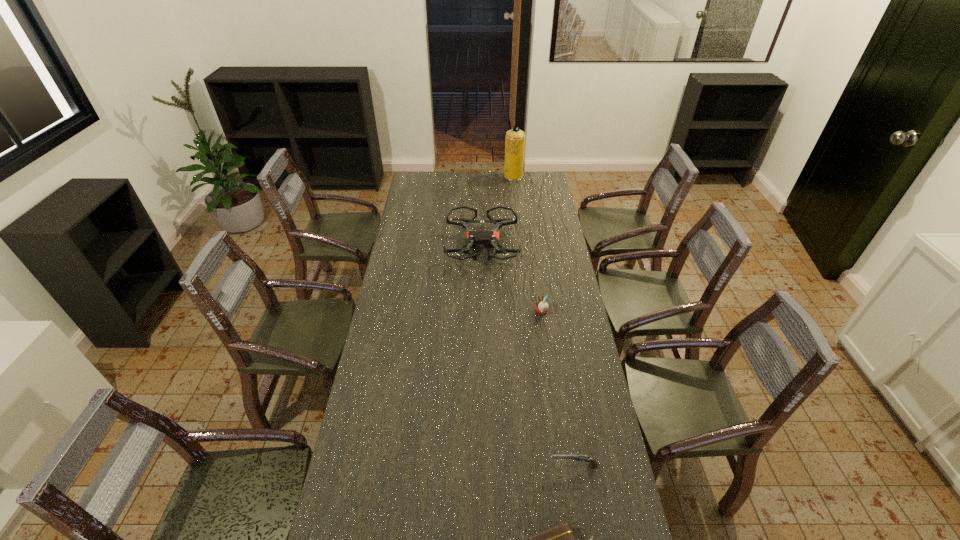
Locate an element on the screen. the farthest object is located at coordinates (515, 138).

I want to click on aerosol can, so click(x=515, y=138).

This screenshot has height=540, width=960. Identify the location of drone. (488, 239).

The height and width of the screenshot is (540, 960). I want to click on muffin, so click(542, 306).

Locate an element on the screen. The height and width of the screenshot is (540, 960). gun is located at coordinates (593, 463).

You are a GUI agent. You are given a task and a screenshot of the screen. Output one action in this format:
    pyautogui.click(x=<x>, y=<y>)
    Task: Click on the free spot located on the front of the farthest object
    This screenshot has width=960, height=540.
    Given the screenshot: What is the action you would take?
    pyautogui.click(x=517, y=213)

This screenshot has height=540, width=960. What are the coordinates of `vacant position located with the camera facing forward on the second farthest object` in the screenshot? It's located at (482, 305).

Locate an element on the screen. This screenshot has width=960, height=540. vacant space located on the front-facing side of the third nearest object is located at coordinates (513, 311).

At what (x,y) coordinates should I click in order to perform the action: click on free spot located on the front-facing side of the third nearest object. Please return your answer as a coordinate pair (x, y). Looking at the image, I should click on (445, 311).

You are a GUI agent. You are given a task and a screenshot of the screen. Output one action in this format:
    pyautogui.click(x=<x>, y=<y>)
    Task: Click on the vacant region located 0.210m on the front-facing side of the third nearest object
    The height and width of the screenshot is (540, 960).
    Given the screenshot: What is the action you would take?
    pyautogui.click(x=484, y=311)